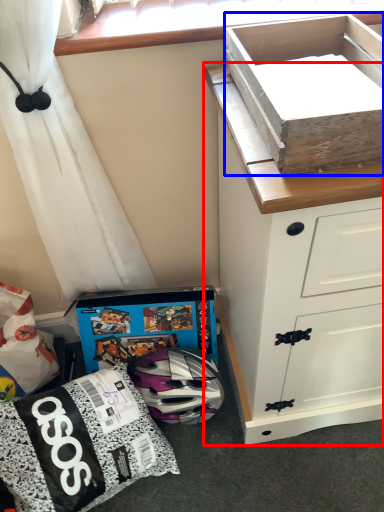
Question: Which of the following is the farthest to the observer, chest of drawers (highlighted by a red box) or box (highlighted by a blue box)?

Choices:
 (A) chest of drawers
 (B) box

Answer: (A)